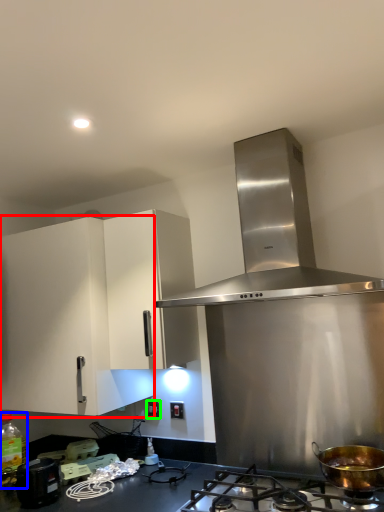
Question: Based on their relative distances, which object is nearer to cabinetry (highlighted by a red box)? Choose from bottle (highlighted by a blue box) and electric outlet (highlighted by a green box).

Choices:
 (A) bottle
 (B) electric outlet

Answer: (A)